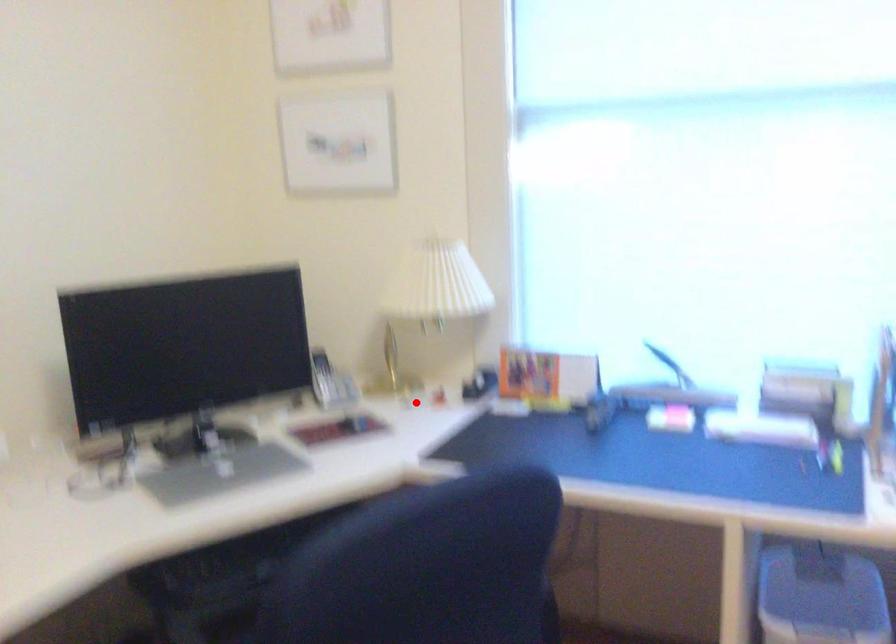
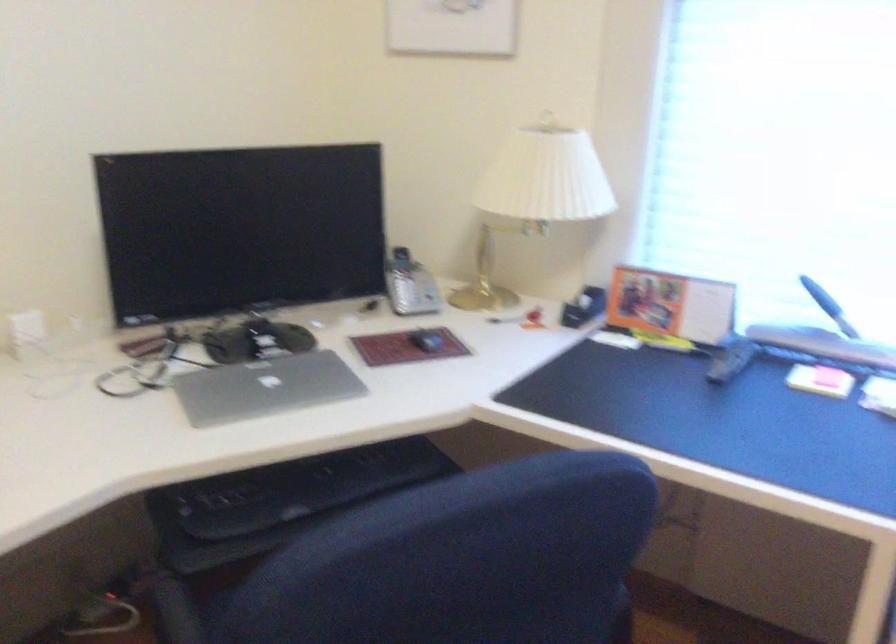
Find the pixel in the second image that matches the highlighted location in the first image.

(504, 319)